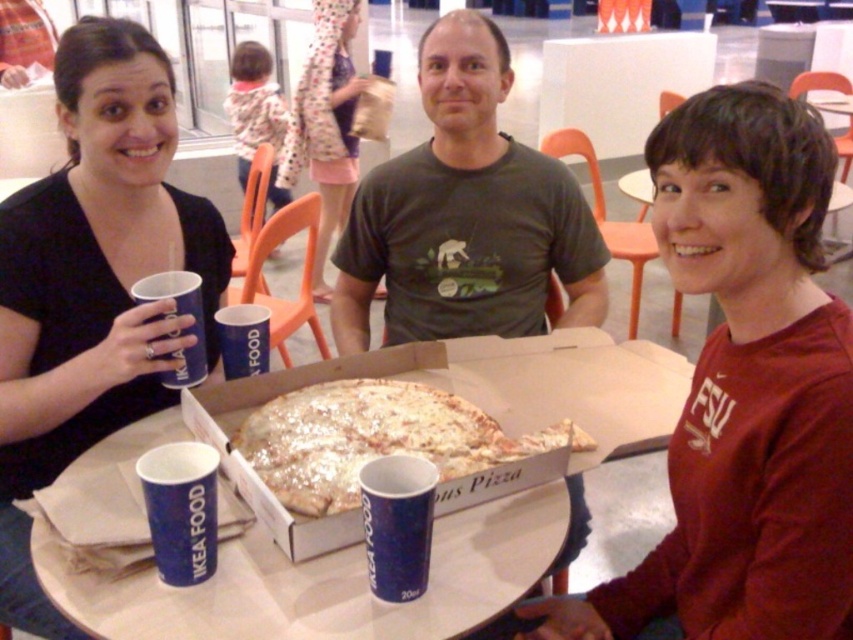
Measure the distance from white cheese pizza at center to blue paper cup at upper left.

white cheese pizza at center is 26.97 centimeters away from blue paper cup at upper left.

Can you confirm if white cheese pizza at center is thinner than blue paper cup at upper left?

No, white cheese pizza at center is not thinner than blue paper cup at upper left.

The width and height of the screenshot is (853, 640). I want to click on white cheese pizza at center, so click(375, 438).

Is matte black shirt at upper left taller than blue paper cup at upper left?

Indeed, matte black shirt at upper left has a greater height compared to blue paper cup at upper left.

Is matte black shirt at upper left in front of blue paper cup at upper left?

Yes, matte black shirt at upper left is in front of blue paper cup at upper left.

Measure the distance between matte black shirt at upper left and camera.

They are 3.53 feet apart.

This screenshot has width=853, height=640. What are the coordinates of `matte black shirt at upper left` in the screenshot? It's located at (91, 284).

Which of these two, white cheese pizza at center or blue paper cup at lower center, stands shorter?

Standing shorter between the two is white cheese pizza at center.

Does white cheese pizza at center appear on the left side of blue paper cup at lower center?

In fact, white cheese pizza at center is to the right of blue paper cup at lower center.

Who is more forward, (393, 435) or (399, 596)?

Point (399, 596) is in front.

Locate an element on the screen. white cheese pizza at center is located at coordinates (375, 438).